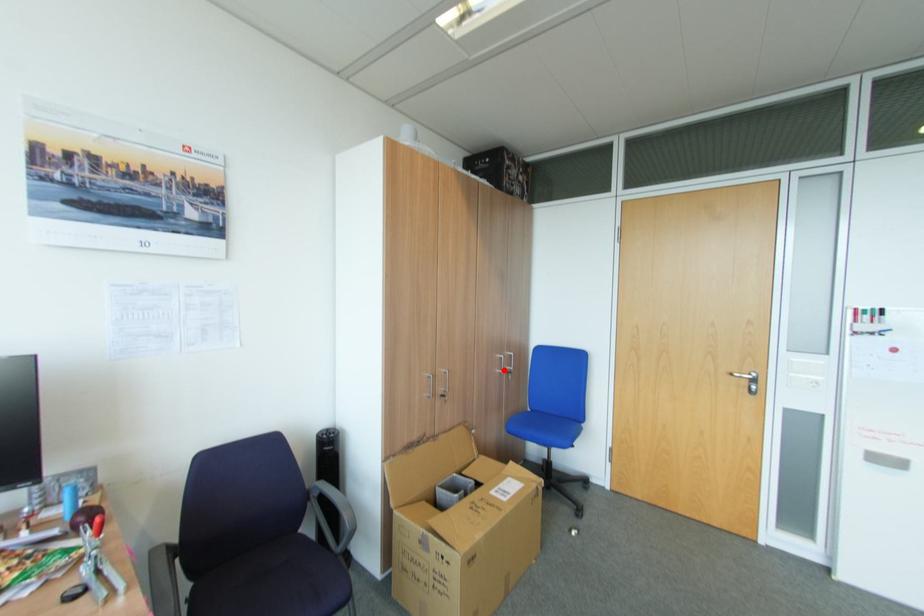
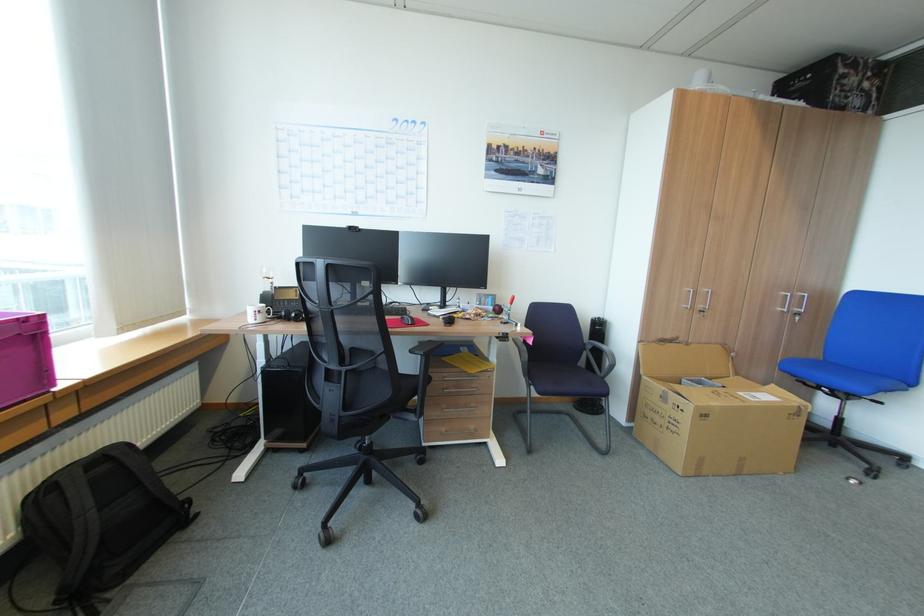
In the second image, find the point that corresponds to the highlighted location in the first image.

(785, 309)